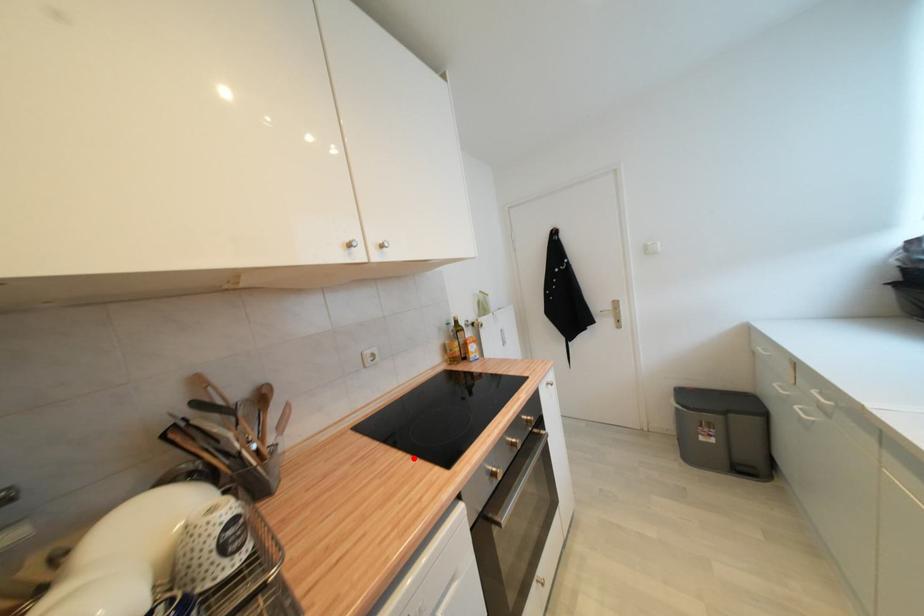
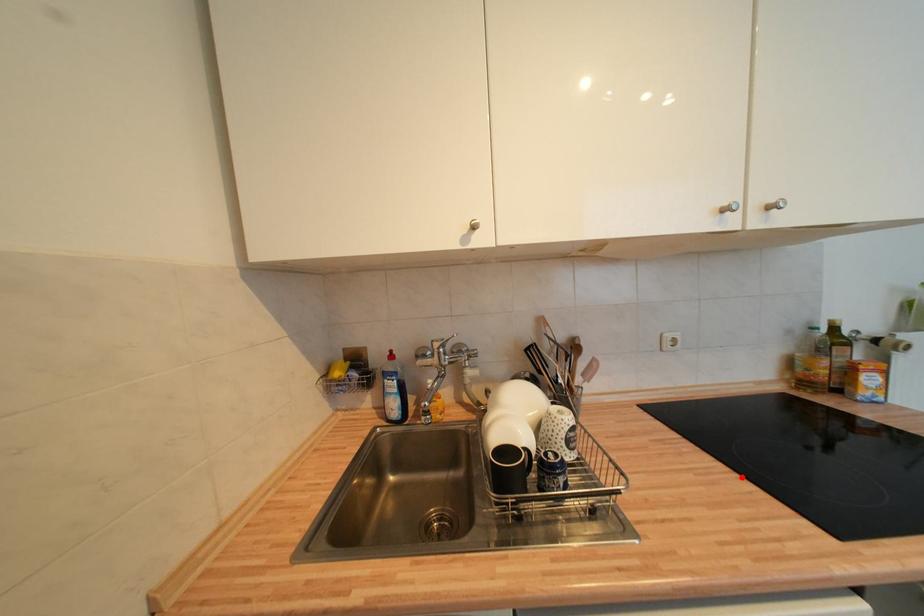
I am providing you with two images of the same scene from different viewpoints. A red point is marked on the first image and another point is marked on the second image. Are the points marked in image1 and image2 representing the same 3D position?

Yes